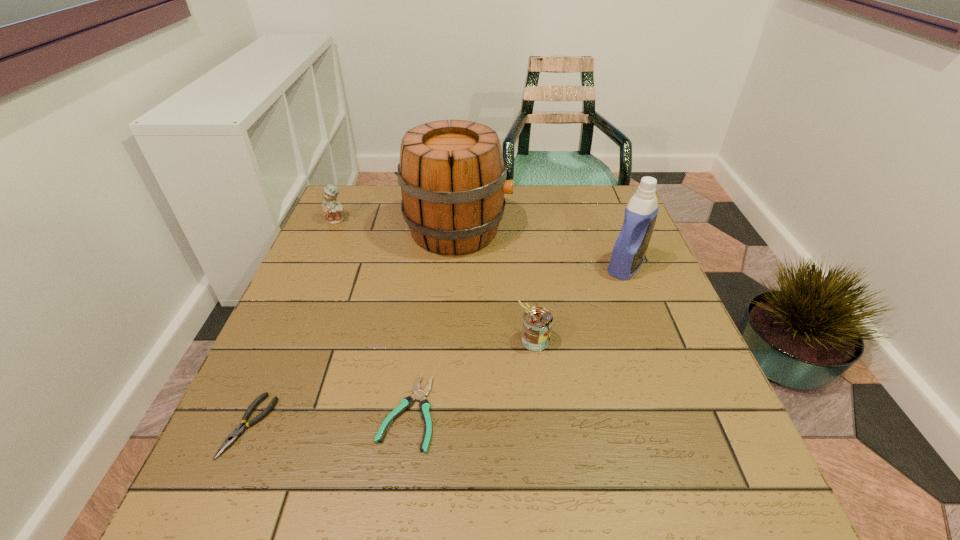
This screenshot has width=960, height=540. Identify the location of cider. (453, 177).

Where is `the rightmost object`? This screenshot has width=960, height=540. the rightmost object is located at coordinates coord(628,253).

The image size is (960, 540). I want to click on teddy bear, so click(x=332, y=209).

At what (x,y) coordinates should I click in order to perform the action: click on the third nearest object. Please return your answer as a coordinate pair (x, y). The image size is (960, 540). Looking at the image, I should click on (537, 321).

Image resolution: width=960 pixels, height=540 pixels. I want to click on the left pliers, so click(239, 430).

This screenshot has width=960, height=540. What are the coordinates of `the taller pliers` in the screenshot? It's located at (239, 430).

I want to click on the shorter pliers, so click(419, 395).

Identify the location of the shortest object. (419, 395).

Identify the location of vacant region located on the side of the cider where the spigot is located. This screenshot has height=540, width=960. (556, 230).

Identify the location of vacant position located on the back of the detergent. (607, 217).